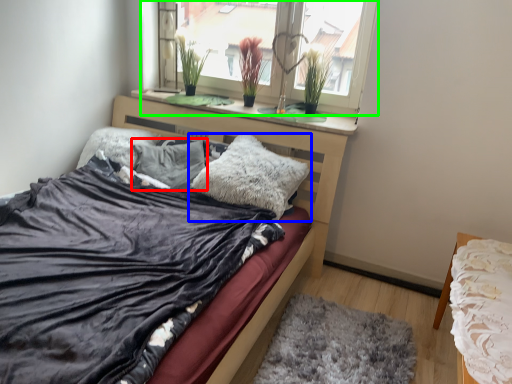
Question: Which object is positioned farthest from pillow (highlighted by a red box)? Select from pillow (highlighted by a blue box) and window (highlighted by a green box).

Choices:
 (A) pillow
 (B) window

Answer: (B)